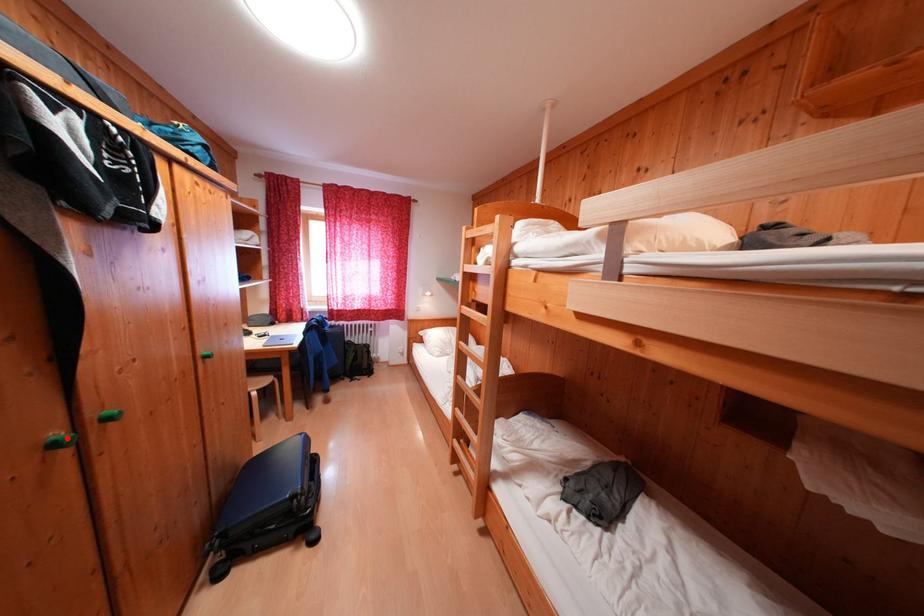
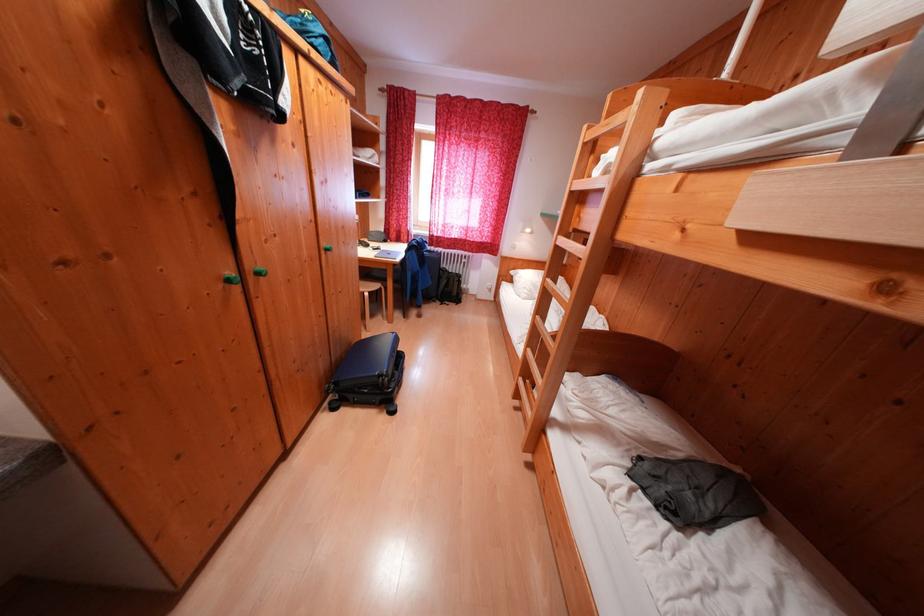
Find the pixel in the second image that matches the highlighted location in the first image.

(238, 278)